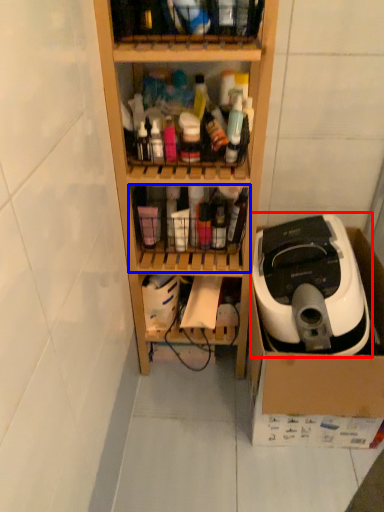
Question: Among these objects, which one is nearest to the camera, home appliance (highlighted by a red box) or shelf (highlighted by a blue box)?

Choices:
 (A) home appliance
 (B) shelf

Answer: (A)